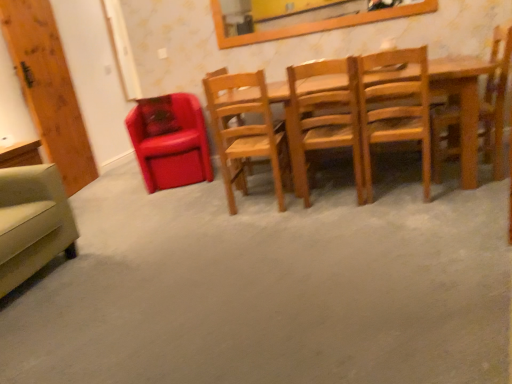
I want to click on vacant region to the left of matte leather chair at left, the 5th chair viewed from the right, so click(x=115, y=190).